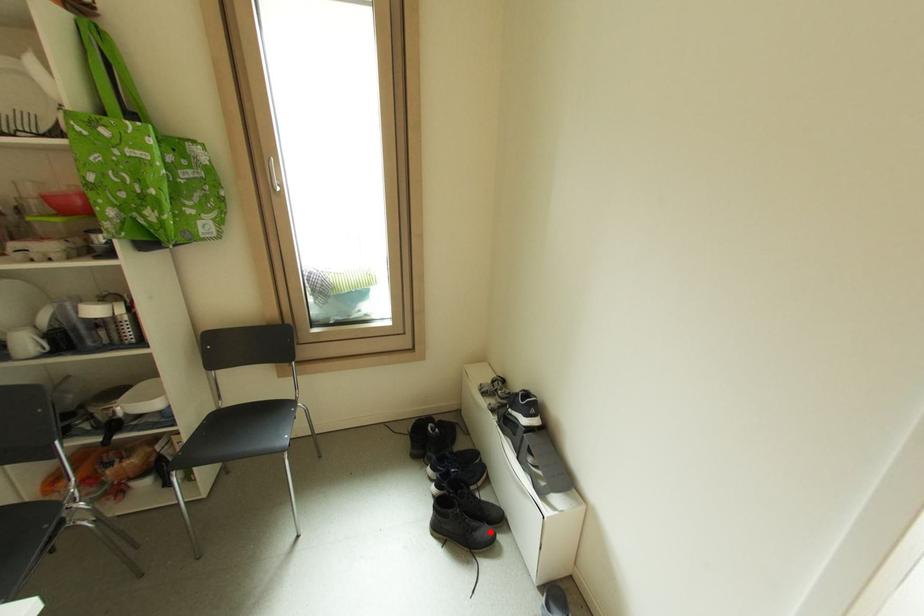
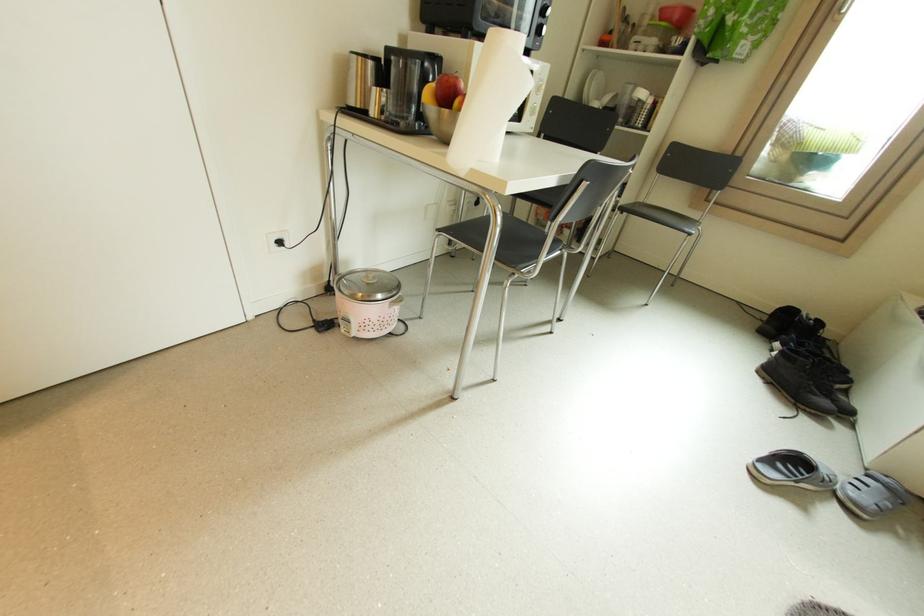
Find the pixel in the second image that matches the highlighted location in the first image.

(830, 403)